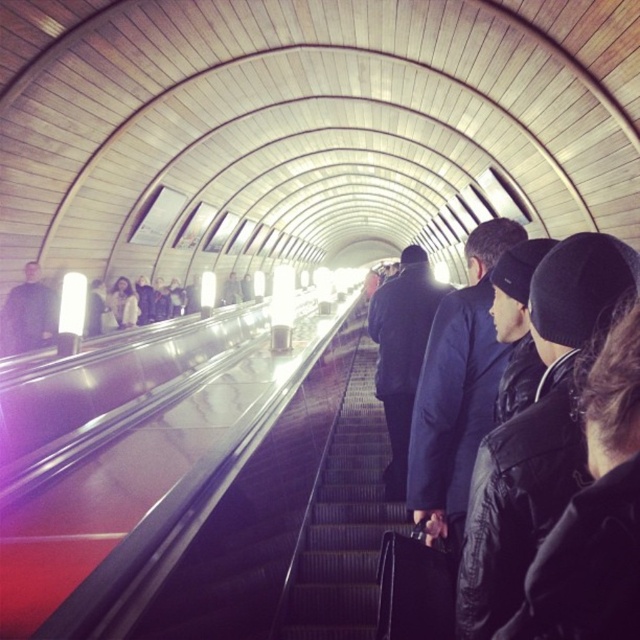
Can you confirm if metallic gray stairs at center is taller than dark blue coat at center?

No.

Is point (376, 488) closer to viewer compared to point (417, 323)?

No.

You are a GUI agent. You are given a task and a screenshot of the screen. Output one action in this format:
    pyautogui.click(x=<x>, y=<y>)
    Task: Click on the metallic gray stairs at center
    
    Given the screenshot: What is the action you would take?
    pyautogui.click(x=342, y=522)

Who is lower down, black matte jacket at center or metallic gray stairs at center?

metallic gray stairs at center is lower down.

Does black matte jacket at center come in front of metallic gray stairs at center?

Yes, black matte jacket at center is closer to the viewer.

Between point (528, 566) and point (346, 595), which one is positioned behind?

The point (346, 595) is behind.

You are a GUI agent. You are given a task and a screenshot of the screen. Output one action in this format:
    pyautogui.click(x=<x>, y=<y>)
    Task: Click on the black matte jacket at center
    This screenshot has height=640, width=640.
    Given the screenshot: What is the action you would take?
    pyautogui.click(x=538, y=429)

Can you confirm if black matte jacket at center is thinner than dark blue jacket at left?

Yes.

Between black matte jacket at center and dark blue jacket at left, which one is positioned lower?

black matte jacket at center is below.

Locate an element on the screen. This screenshot has width=640, height=640. black matte jacket at center is located at coordinates (538, 429).

Locate an element on the screen. The width and height of the screenshot is (640, 640). black matte jacket at center is located at coordinates (538, 429).